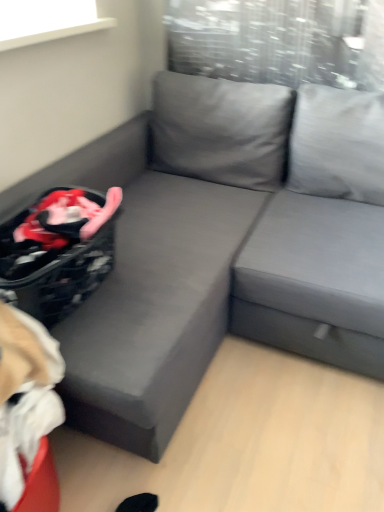
Question: From a real-world perspective, is beige fabric bean bag chair at lower left over gray fabric couch at center?

Choices:
 (A) no
 (B) yes

Answer: (B)

Question: Is beige fabric bean bag chair at lower left in contact with gray fabric couch at center?

Choices:
 (A) yes
 (B) no

Answer: (B)

Question: Would you consider beige fabric bean bag chair at lower left to be distant from gray fabric couch at center?

Choices:
 (A) no
 (B) yes

Answer: (A)

Question: Is beige fabric bean bag chair at lower left wider than gray fabric couch at center?

Choices:
 (A) no
 (B) yes

Answer: (A)

Question: From the image's perspective, is beige fabric bean bag chair at lower left under gray fabric couch at center?

Choices:
 (A) yes
 (B) no

Answer: (A)

Question: Relative to beige fabric bean bag chair at lower left, is gray fabric couch at center in front or behind?

Choices:
 (A) behind
 (B) front

Answer: (A)

Question: From a real-world perspective, is gray fabric couch at center physically located above or below beige fabric bean bag chair at lower left?

Choices:
 (A) below
 (B) above

Answer: (A)

Question: From the image's perspective, is gray fabric couch at center located above or below beige fabric bean bag chair at lower left?

Choices:
 (A) above
 (B) below

Answer: (A)

Question: Does point (314, 289) appear closer or farther from the camera than point (14, 407)?

Choices:
 (A) farther
 (B) closer

Answer: (A)

Question: Is gray fabric couch at center in front of or behind black textured laundry basket at lower left in the image?

Choices:
 (A) front
 (B) behind

Answer: (B)

Question: Is gray fabric couch at center inside or outside of black textured laundry basket at lower left?

Choices:
 (A) outside
 (B) inside

Answer: (A)

Question: Is point (311, 331) closer or farther from the camera than point (66, 226)?

Choices:
 (A) closer
 (B) farther

Answer: (B)

Question: Looking at their shapes, would you say gray fabric couch at center is wider or thinner than black textured laundry basket at lower left?

Choices:
 (A) wide
 (B) thin

Answer: (A)

Question: From a real-world perspective, is beige fabric bean bag chair at lower left physically located above or below black textured laundry basket at lower left?

Choices:
 (A) above
 (B) below

Answer: (B)

Question: Is beige fabric bean bag chair at lower left bigger or smaller than black textured laundry basket at lower left?

Choices:
 (A) small
 (B) big

Answer: (B)